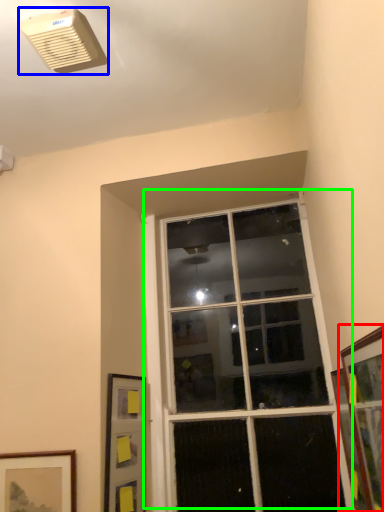
Question: Based on their relative distances, which object is farther from picture frame (highlighted by a red box)? Choose from air conditioning (highlighted by a blue box) and window (highlighted by a green box).

Choices:
 (A) air conditioning
 (B) window

Answer: (A)